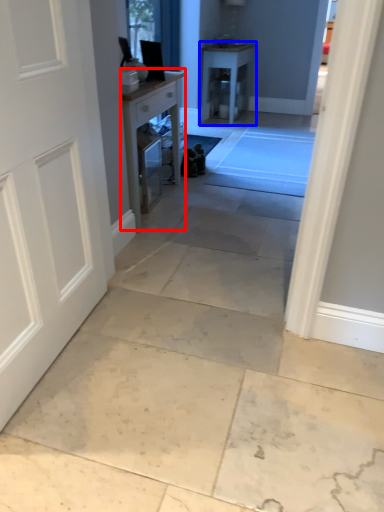
Question: Among these objects, which one is farthest to the camera, table (highlighted by a red box) or table (highlighted by a blue box)?

Choices:
 (A) table
 (B) table

Answer: (B)